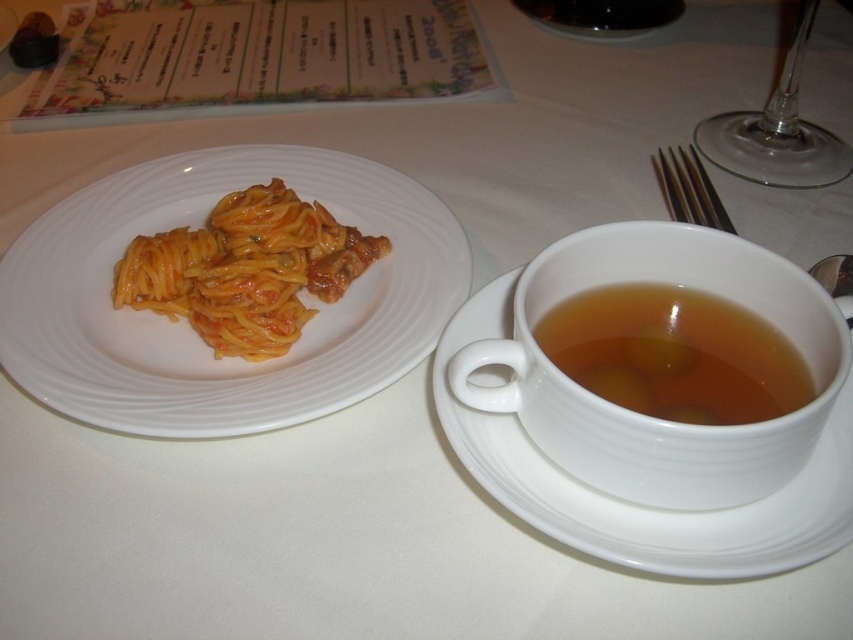
Question: Is white ceramic plate at upper left further to the viewer compared to white ceramic saucer at right?

Choices:
 (A) no
 (B) yes

Answer: (B)

Question: Can you confirm if yellow matte pasta at left is positioned below silver metallic fork at upper right?

Choices:
 (A) yes
 (B) no

Answer: (A)

Question: Estimate the real-world distances between objects in this image. Which object is farther from the silver metallic fork at upper right?

Choices:
 (A) yellow matte pasta at left
 (B) brown translucent cup at right
 (C) white ceramic saucer at right

Answer: (A)

Question: Among these objects, which one is nearest to the camera?

Choices:
 (A) white ceramic plate at upper left
 (B) silver metallic fork at upper right

Answer: (A)

Question: Is white ceramic saucer at right positioned in front of silver metallic fork at upper right?

Choices:
 (A) yes
 (B) no

Answer: (A)

Question: Which is nearer to the yellow matte pasta at left?

Choices:
 (A) silver metallic fork at upper right
 (B) white ceramic plate at upper left
 (C) white ceramic saucer at right

Answer: (B)